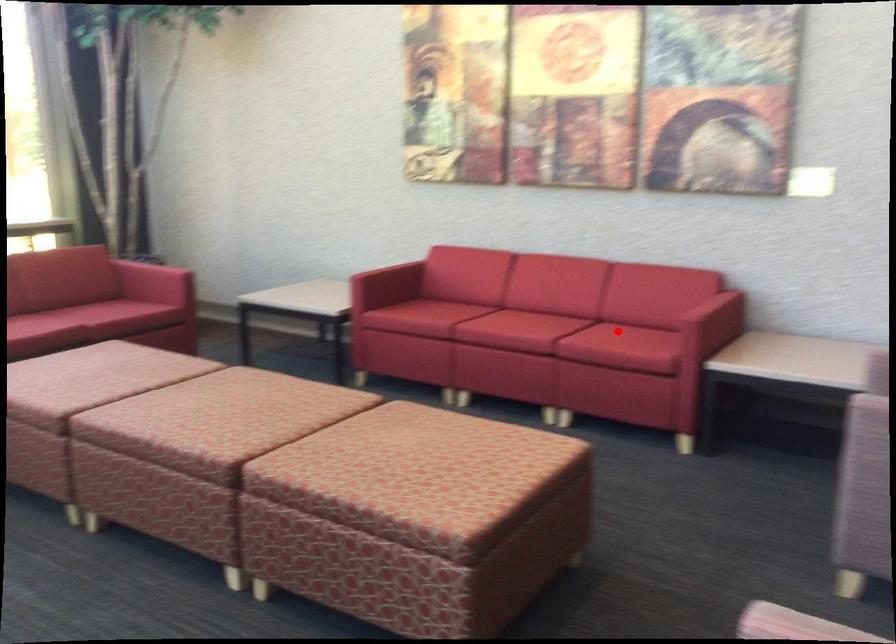
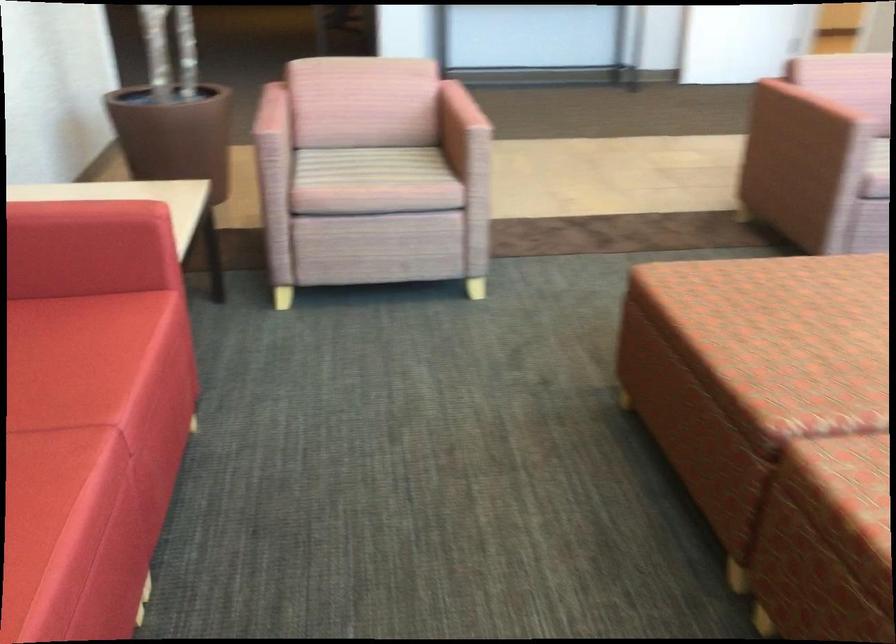
Question: A red point is marked in image1. In image2, is the corresponding 3D point closer to the camera or farther? Reply with the corresponding letter.

Choices:
 (A) The corresponding 3D point is closer.
 (B) The corresponding 3D point is farther.

Answer: (A)